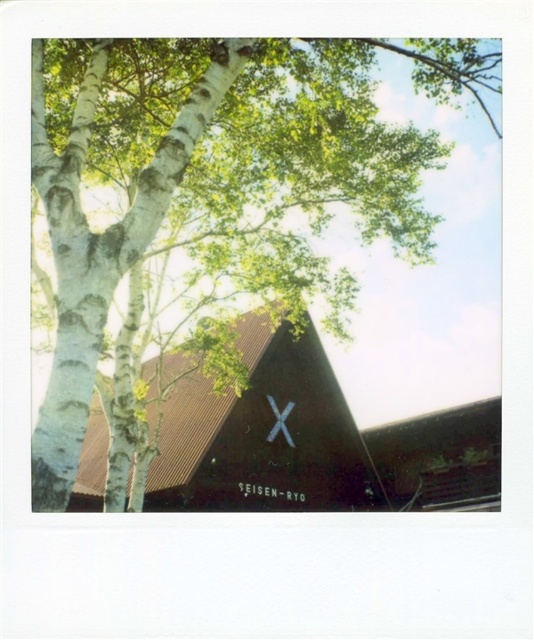
You are standing in the outdoor scene with the large birch tree in the foreground. You see a point marked at coordinates (263,435). What object is located at that point?

The point at coordinates (263,435) marks the brown corrugated metal chapel at center.

You are standing in the outdoor scene and want to locate the point marked at coordinates (219,179). According to the image, where exactly is this point located?

The point marked at coordinates (219,179) is located on the white bark tree at upper left.